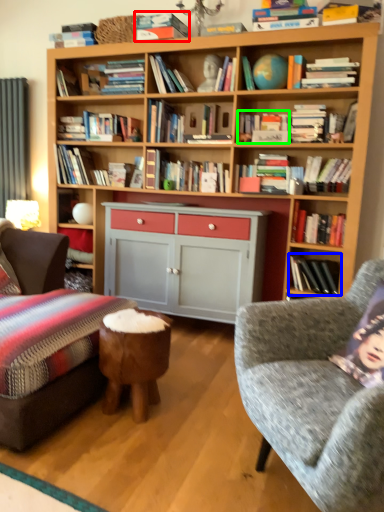
Question: Based on their relative distances, which object is nearer to book (highlighted by a red box)? Choose from book (highlighted by a blue box) and magazine (highlighted by a green box).

Choices:
 (A) book
 (B) magazine

Answer: (B)